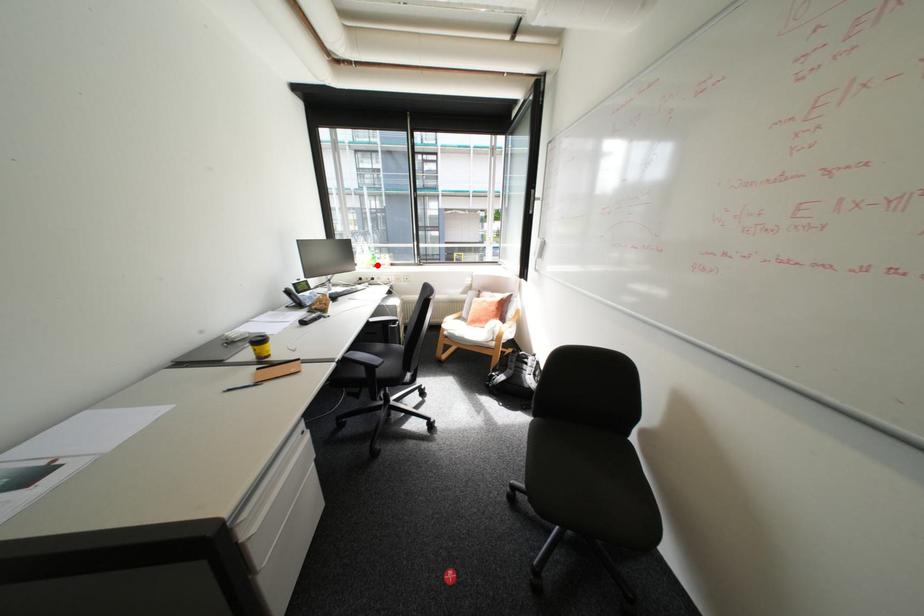
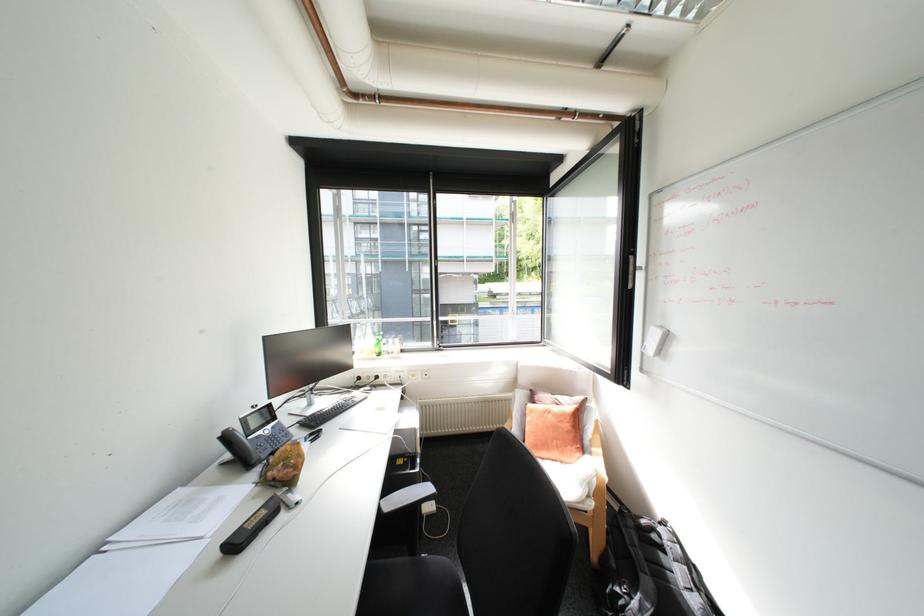
Locate, in the second image, the point that corresponds to the highlighted location in the first image.

(379, 354)